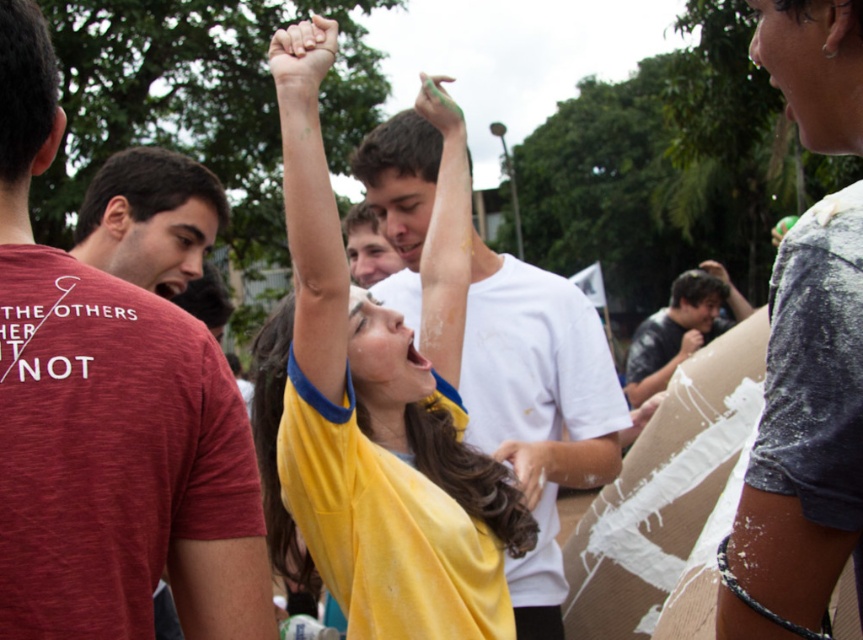
Can you confirm if maroon heathered t-shirt at left is shorter than matte red t-shirt at left?

Incorrect, maroon heathered t-shirt at left's height does not fall short of matte red t-shirt at left's.

Image resolution: width=863 pixels, height=640 pixels. What do you see at coordinates (109, 422) in the screenshot?
I see `maroon heathered t-shirt at left` at bounding box center [109, 422].

Find the location of a particular element. This screenshot has height=640, width=863. maroon heathered t-shirt at left is located at coordinates (109, 422).

Locate an element on the screen. The height and width of the screenshot is (640, 863). maroon heathered t-shirt at left is located at coordinates (109, 422).

Between maroon heathered t-shirt at left and smooth yellow shirt at center, which one has less height?

Standing shorter between the two is smooth yellow shirt at center.

The width and height of the screenshot is (863, 640). I want to click on maroon heathered t-shirt at left, so click(x=109, y=422).

Between point (98, 403) and point (357, 211), which one is positioned in front?

Point (98, 403) is in front.

The width and height of the screenshot is (863, 640). I want to click on maroon heathered t-shirt at left, so click(109, 422).

Is point (165, 353) positioned behind point (817, 378)?

Yes, it is.

Which is in front, point (108, 300) or point (786, 461)?

Point (786, 461)

I want to click on maroon heathered t-shirt at left, so click(x=109, y=422).